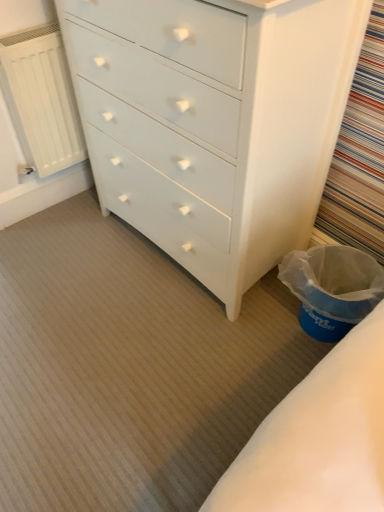
Question: Is blue plastic laundry basket at lower right outside of white painted wood chest of drawers at center?

Choices:
 (A) no
 (B) yes

Answer: (B)

Question: Is blue plastic laundry basket at lower right further to camera compared to white painted wood chest of drawers at center?

Choices:
 (A) no
 (B) yes

Answer: (B)

Question: Is blue plastic laundry basket at lower right wider than white painted wood chest of drawers at center?

Choices:
 (A) yes
 (B) no

Answer: (B)

Question: Does blue plastic laundry basket at lower right turn towards white painted wood chest of drawers at center?

Choices:
 (A) no
 (B) yes

Answer: (A)

Question: Is blue plastic laundry basket at lower right in front of white painted wood chest of drawers at center?

Choices:
 (A) no
 (B) yes

Answer: (A)

Question: In terms of width, does white painted wood chest of drawers at center look wider or thinner when compared to blue plastic laundry basket at lower right?

Choices:
 (A) wide
 (B) thin

Answer: (A)

Question: Considering the positions of white painted wood chest of drawers at center and blue plastic laundry basket at lower right in the image, is white painted wood chest of drawers at center bigger or smaller than blue plastic laundry basket at lower right?

Choices:
 (A) small
 (B) big

Answer: (B)

Question: Does point (286, 50) appear closer or farther from the camera than point (352, 325)?

Choices:
 (A) farther
 (B) closer

Answer: (B)

Question: Considering the positions of white painted wood chest of drawers at center and blue plastic laundry basket at lower right in the image, is white painted wood chest of drawers at center taller or shorter than blue plastic laundry basket at lower right?

Choices:
 (A) short
 (B) tall

Answer: (B)

Question: Considering the relative positions of blue plastic laundry basket at lower right and white painted wood chest of drawers at center in the image provided, is blue plastic laundry basket at lower right to the left or to the right of white painted wood chest of drawers at center?

Choices:
 (A) left
 (B) right

Answer: (B)

Question: Looking at the image, does blue plastic laundry basket at lower right seem bigger or smaller compared to white painted wood chest of drawers at center?

Choices:
 (A) big
 (B) small

Answer: (B)

Question: Is blue plastic laundry basket at lower right wider or thinner than white painted wood chest of drawers at center?

Choices:
 (A) thin
 (B) wide

Answer: (A)

Question: In terms of height, does blue plastic laundry basket at lower right look taller or shorter compared to white painted wood chest of drawers at center?

Choices:
 (A) tall
 (B) short

Answer: (B)

Question: Is white matte radiator at left bigger or smaller than white painted wood chest of drawers at center?

Choices:
 (A) big
 (B) small

Answer: (B)

Question: Relative to white painted wood chest of drawers at center, is white matte radiator at left in front or behind?

Choices:
 (A) behind
 (B) front

Answer: (A)